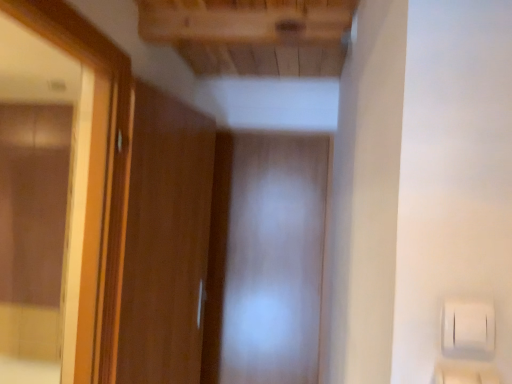
Question: Should I look upward or downward to see wooden door at left?

Choices:
 (A) up
 (B) down

Answer: (B)

Question: From a real-world perspective, is transparent plastic screen door at center positioned over wooden frame mirror at left based on gravity?

Choices:
 (A) yes
 (B) no

Answer: (B)

Question: Is transparent plastic screen door at center to the left of wooden frame mirror at left from the viewer's perspective?

Choices:
 (A) no
 (B) yes

Answer: (A)

Question: Does transparent plastic screen door at center lie behind wooden frame mirror at left?

Choices:
 (A) yes
 (B) no

Answer: (A)

Question: Would you say wooden frame mirror at left is part of transparent plastic screen door at center's contents?

Choices:
 (A) no
 (B) yes

Answer: (A)

Question: Does transparent plastic screen door at center have a lesser height compared to wooden frame mirror at left?

Choices:
 (A) no
 (B) yes

Answer: (A)

Question: Is transparent plastic screen door at center touching wooden frame mirror at left?

Choices:
 (A) yes
 (B) no

Answer: (B)

Question: From a real-world perspective, is transparent plastic screen door at center located higher than wooden door at left?

Choices:
 (A) no
 (B) yes

Answer: (A)

Question: From the image's perspective, is transparent plastic screen door at center below wooden door at left?

Choices:
 (A) yes
 (B) no

Answer: (A)

Question: Is the depth of transparent plastic screen door at center less than that of wooden door at left?

Choices:
 (A) no
 (B) yes

Answer: (A)

Question: Is transparent plastic screen door at center positioned behind wooden door at left?

Choices:
 (A) no
 (B) yes

Answer: (B)

Question: From a real-world perspective, is transparent plastic screen door at center physically below wooden door at left?

Choices:
 (A) no
 (B) yes

Answer: (B)

Question: Is transparent plastic screen door at center oriented towards wooden door at left?

Choices:
 (A) yes
 (B) no

Answer: (A)

Question: Is wooden frame mirror at left thinner than wooden door at left?

Choices:
 (A) yes
 (B) no

Answer: (B)